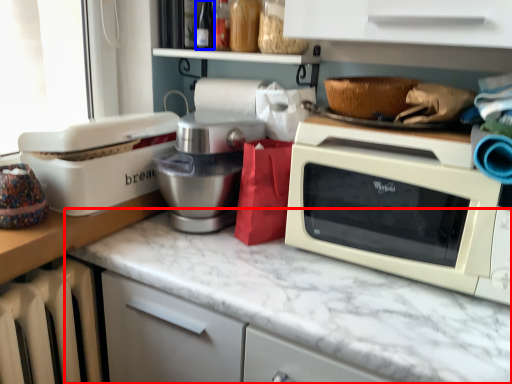
Question: Which object is closer to the camera taking this photo, countertop (highlighted by a red box) or bottle (highlighted by a blue box)?

Choices:
 (A) countertop
 (B) bottle

Answer: (A)